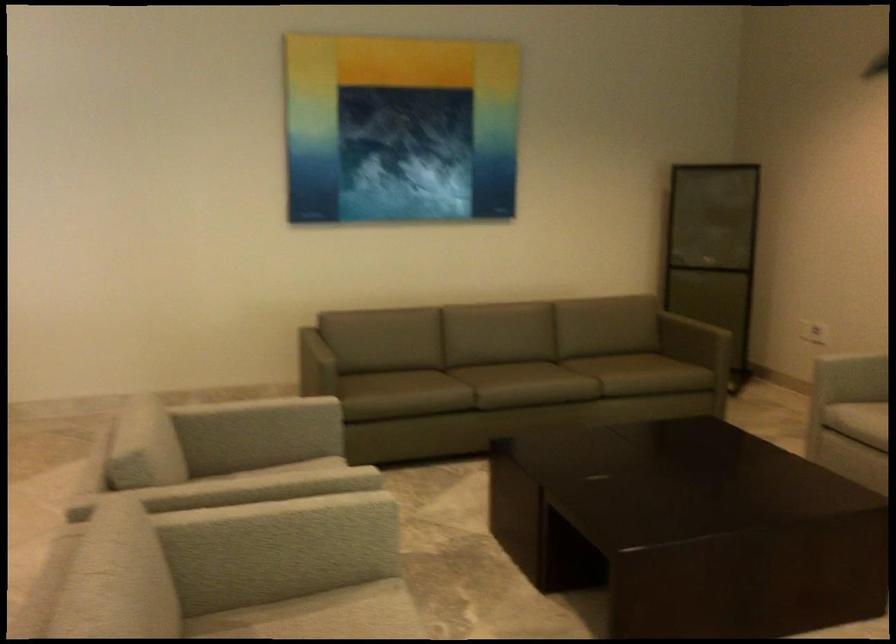
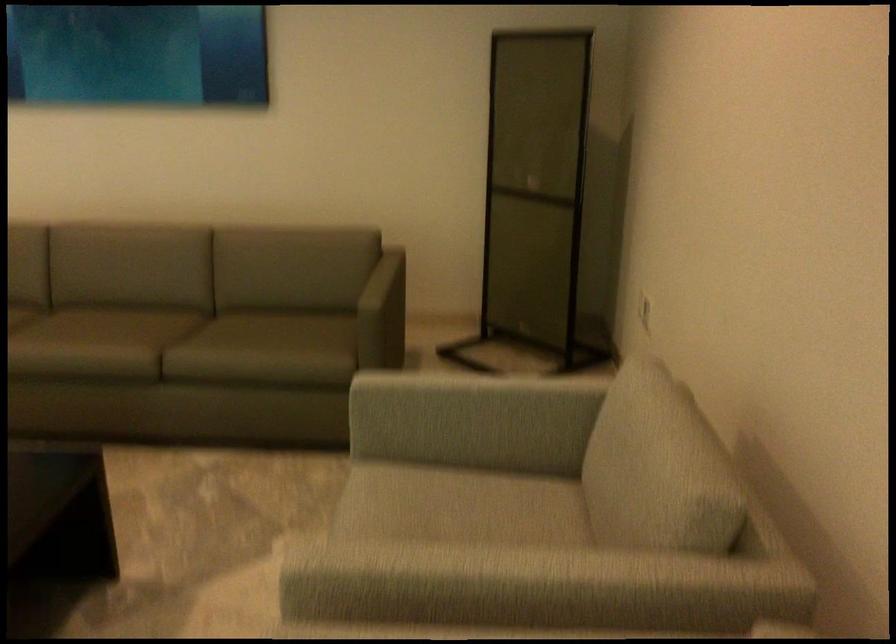
What movement of the cameraman would produce the second image?

The movement direction of the cameraman is right, forward.